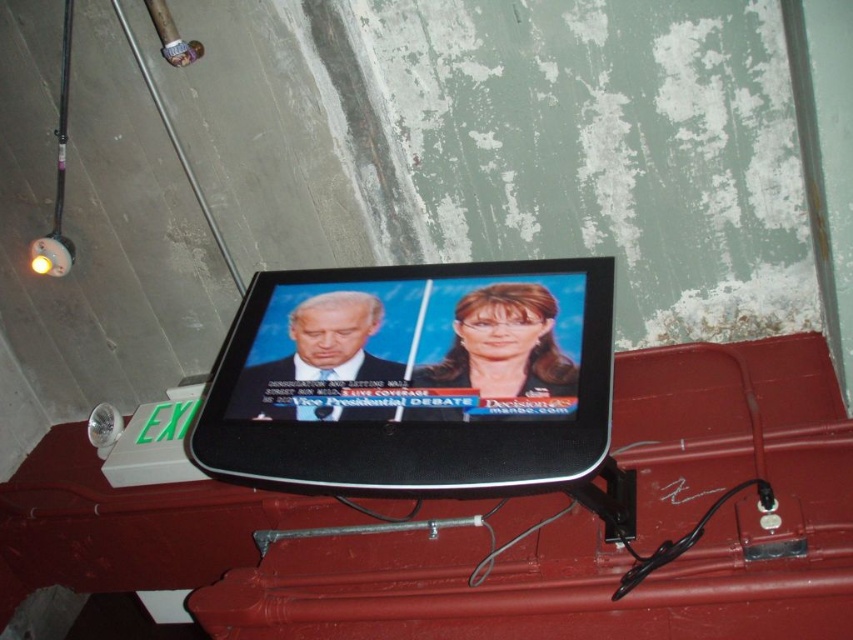
Does point (465, 436) lie in front of point (51, 260)?

Yes.

Locate an element on the screen. The image size is (853, 640). black glossy screen at center is located at coordinates (415, 378).

Image resolution: width=853 pixels, height=640 pixels. What are the coordinates of `black glossy screen at center` in the screenshot? It's located at (415, 378).